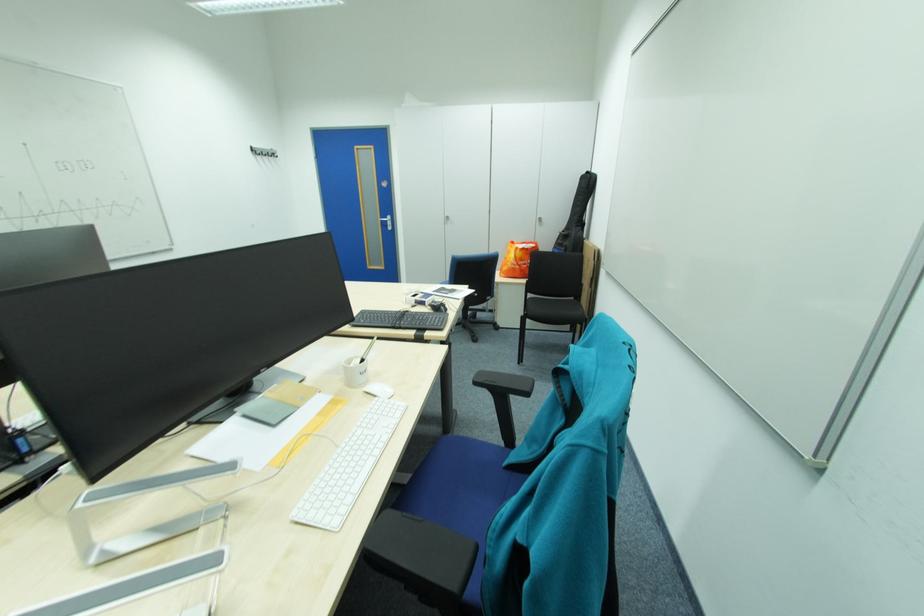
Where is `white and silver pen`? The height and width of the screenshot is (616, 924). white and silver pen is located at coordinates (367, 350).